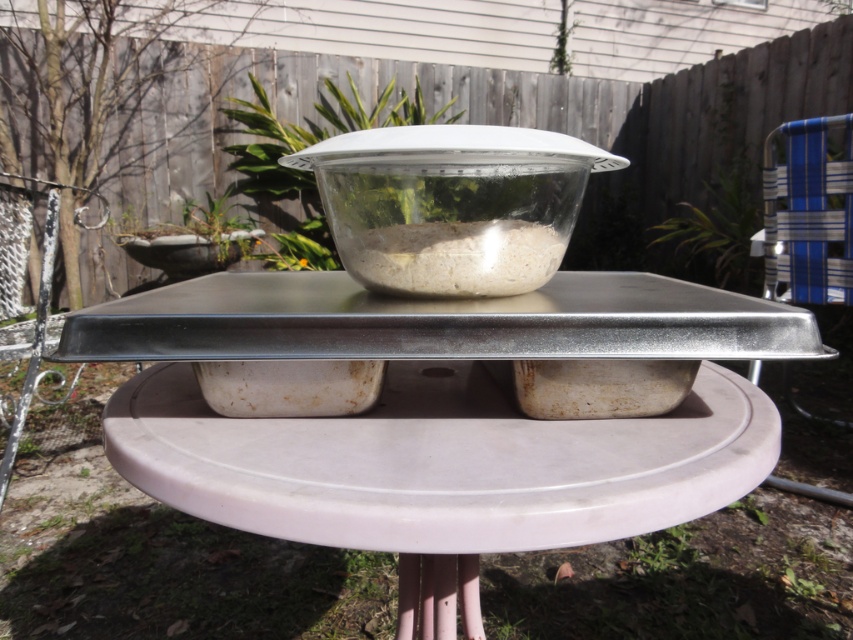
Does point (572, 337) come farther from viewer compared to point (531, 252)?

No, it is not.

Can you confirm if metallic gray tray at center is taller than translucent glass bowl at center?

Correct, metallic gray tray at center is much taller as translucent glass bowl at center.

Who is more forward, [357,496] or [444,289]?

Positioned in front is point [357,496].

I want to click on metallic gray tray at center, so click(440, 417).